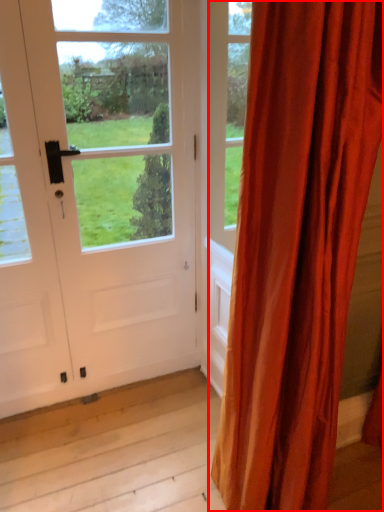
Question: From the image's perspective, where is curtain (annotated by the red box) located in relation to door in the image?

Choices:
 (A) above
 (B) below

Answer: (B)